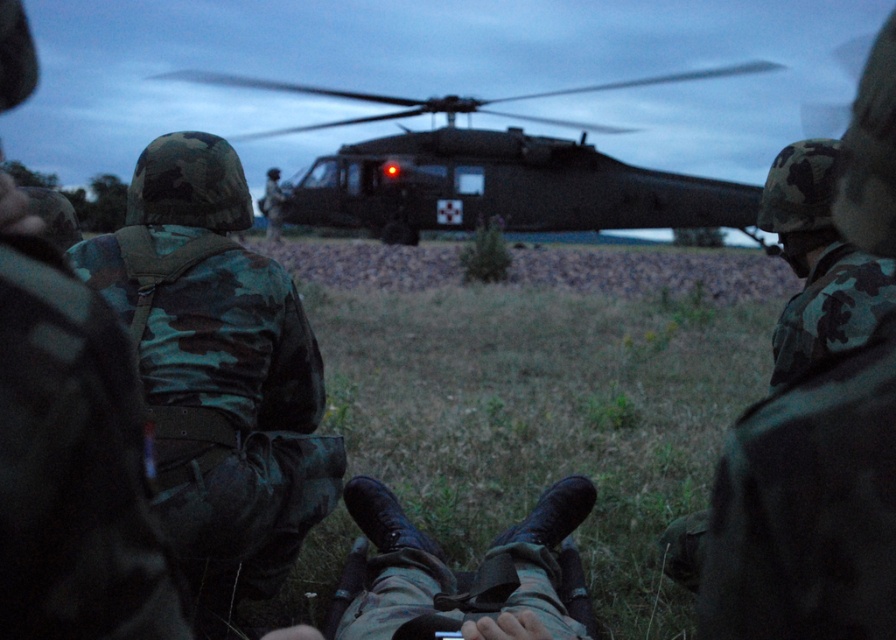
Question: Can you confirm if dark matte helicopter at center is wider than matte black gun at lower center?

Choices:
 (A) yes
 (B) no

Answer: (A)

Question: Which object appears closest to the camera in this image?

Choices:
 (A) camo fabric uniform at center
 (B) matte black gun at lower center
 (C) dark matte helicopter at center

Answer: (A)

Question: Which object is the farthest from the matte black gun at lower center?

Choices:
 (A) camo fabric uniform at center
 (B) dark matte helicopter at center

Answer: (B)

Question: Can you confirm if dark matte helicopter at center is smaller than matte black gun at lower center?

Choices:
 (A) no
 (B) yes

Answer: (A)

Question: Is camo fabric uniform at center to the left of matte black gun at lower center from the viewer's perspective?

Choices:
 (A) no
 (B) yes

Answer: (B)

Question: Among these objects, which one is nearest to the camera?

Choices:
 (A) dark matte helicopter at center
 (B) matte black gun at lower center

Answer: (B)